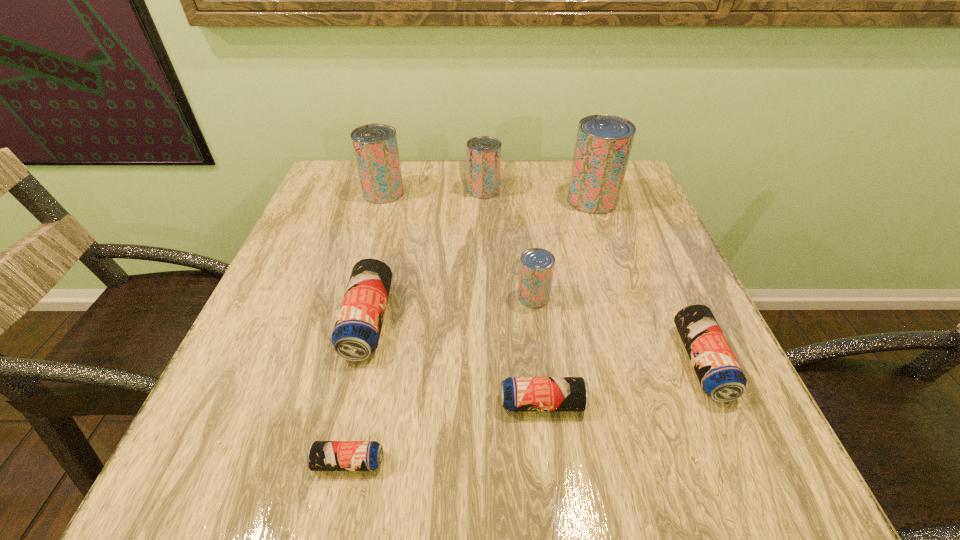
Locate an element on the screen. This screenshot has height=540, width=960. the biggest red beer can is located at coordinates (603, 145).

I want to click on the tallest object, so click(x=603, y=145).

Find the location of `the third smallest red beer can`. the third smallest red beer can is located at coordinates click(x=375, y=146).

The height and width of the screenshot is (540, 960). In order to click on the leftmost red beer can in this screenshot , I will do `click(375, 146)`.

Identify the location of the second smallest red beer can. This screenshot has height=540, width=960. (483, 152).

What are the coordinates of `the sixth shortest beer can` in the screenshot? It's located at (483, 152).

Locate an element on the screen. The height and width of the screenshot is (540, 960). the fourth tallest beer can is located at coordinates (536, 270).

The image size is (960, 540). What are the coordinates of `the nearest red beer can` in the screenshot? It's located at (536, 270).

This screenshot has height=540, width=960. I want to click on the biggest blue beer can, so [356, 333].

The image size is (960, 540). Identify the location of the fifth tallest beer can. (356, 333).